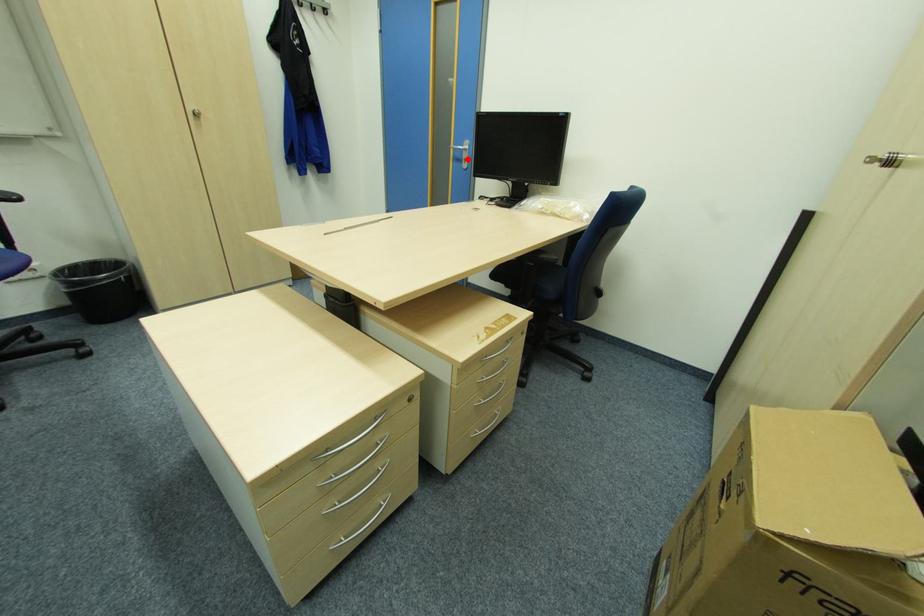
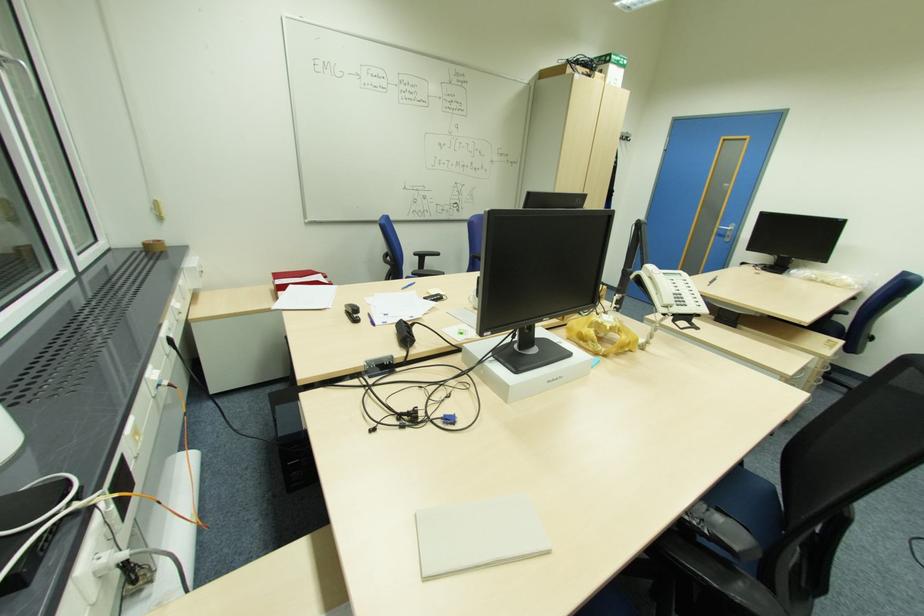
Question: I am providing you with two images of the same scene from different viewpoints. Given a red point in image1, look at the same physical point in image2. Is it:

Choices:
 (A) Closer to the viewpoint
 (B) Farther from the viewpoint

Answer: (B)